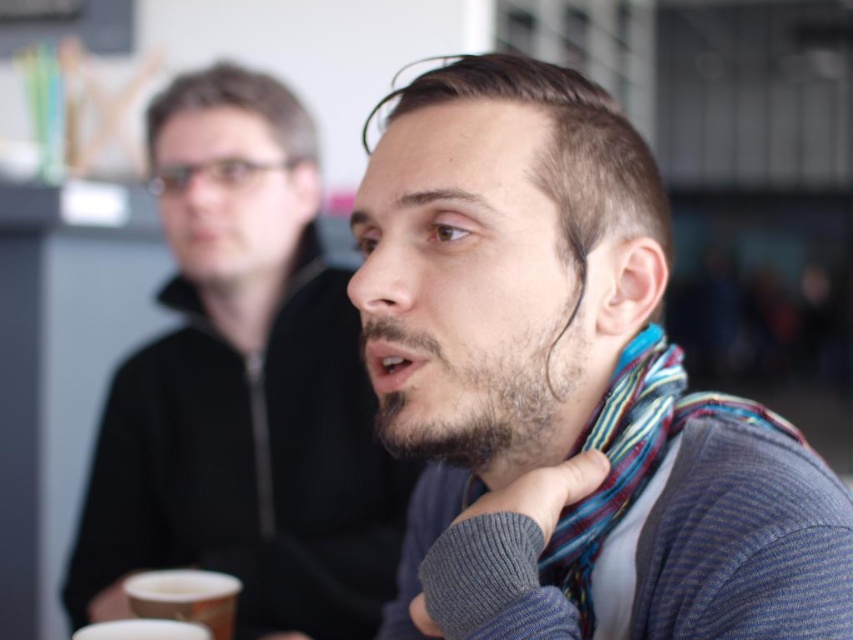
Based on the photo, between matte black jacket at center and striped fabric scarf at center, which one is positioned lower?

striped fabric scarf at center is below.

Is matte black jacket at center below striped fabric scarf at center?

Incorrect, matte black jacket at center is not positioned below striped fabric scarf at center.

Where is `matte black jacket at center`? This screenshot has height=640, width=853. matte black jacket at center is located at coordinates 244,387.

Does striped scarf at center have a greater width compared to matte black jacket at center?

No.

Measure the distance from striped scarf at center to matte black jacket at center.

They are 26.48 inches apart.

Locate an element on the screen. striped scarf at center is located at coordinates (567, 387).

Does striped scarf at center lie behind striped fabric scarf at center?

No, striped scarf at center is in front of striped fabric scarf at center.

Does striped scarf at center have a smaller size compared to striped fabric scarf at center?

No, striped scarf at center is not smaller than striped fabric scarf at center.

Does point (498, 116) lie behind point (564, 520)?

No, it is not.

You are a GUI agent. You are given a task and a screenshot of the screen. Output one action in this format:
    pyautogui.click(x=<x>, y=<y>)
    Task: Click on the striped scarf at center
    The height and width of the screenshot is (640, 853).
    Given the screenshot: What is the action you would take?
    pyautogui.click(x=567, y=387)